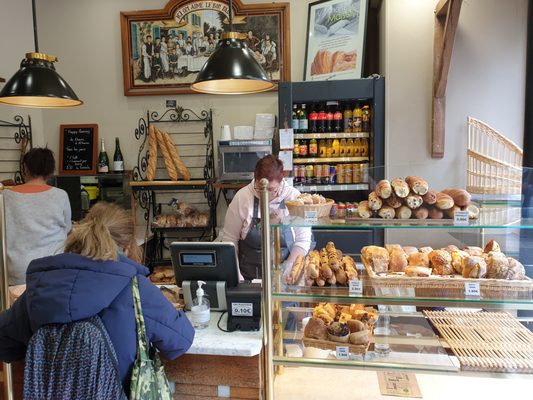
Locate an element on the screen. overhead lights is located at coordinates (226, 65), (40, 83).